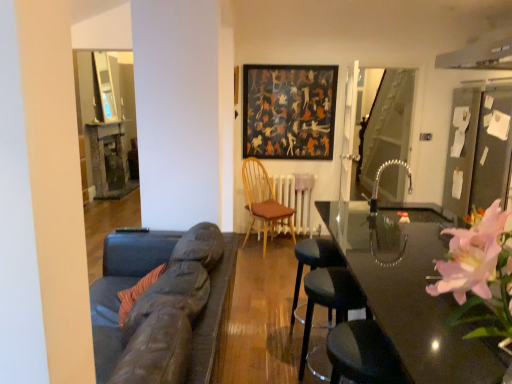
Question: From a real-world perspective, relative to wooden chair with brown cushion at center, arranged as the first chair when viewed from the back, is dark textured painting at upper center vertically above or below?

Choices:
 (A) above
 (B) below

Answer: (A)

Question: Considering their positions, is dark textured painting at upper center located in front of or behind wooden chair with brown cushion at center, which ranks as the second chair in front-to-back order?

Choices:
 (A) behind
 (B) front

Answer: (A)

Question: Which object is the farthest from the glossy black table at center?

Choices:
 (A) dark gray fabric bar stool at center
 (B) black leather swivel chair at lower right
 (C) black leather stool at lower right, arranged as the 1th chair when viewed from the front
 (D) wooden chair with brown cushion at center, arranged as the first chair when viewed from the back
 (E) transparent glass door at right

Answer: (E)

Question: Based on their relative distances, which object is nearer to the dark textured painting at upper center?

Choices:
 (A) black leather stool at lower right, which is counted as the second chair, starting from the back
 (B) glossy black table at center
 (C) transparent glass door at right
 (D) dark gray fabric bar stool at center
 (E) wooden chair with brown cushion at center, arranged as the first chair when viewed from the back

Answer: (E)